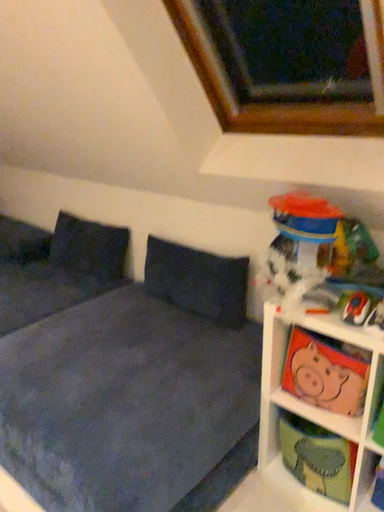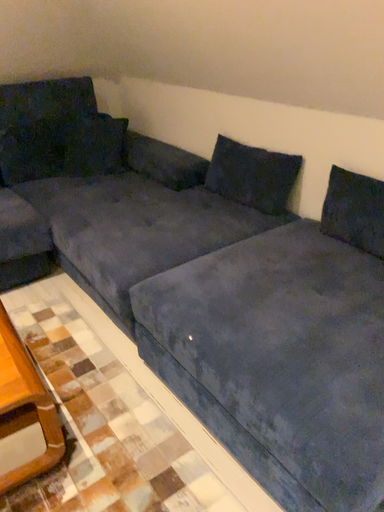
Question: How did the camera likely rotate when shooting the video?

Choices:
 (A) rotated upward
 (B) rotated downward

Answer: (B)